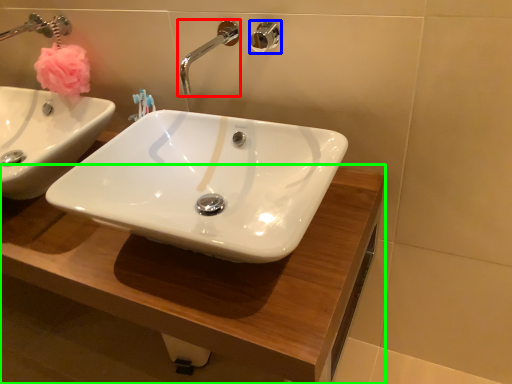
Question: Based on their relative distances, which object is farther from tap (highlighted by a red box)? Choose from shower (highlighted by a blue box) and counter top (highlighted by a green box).

Choices:
 (A) shower
 (B) counter top

Answer: (B)